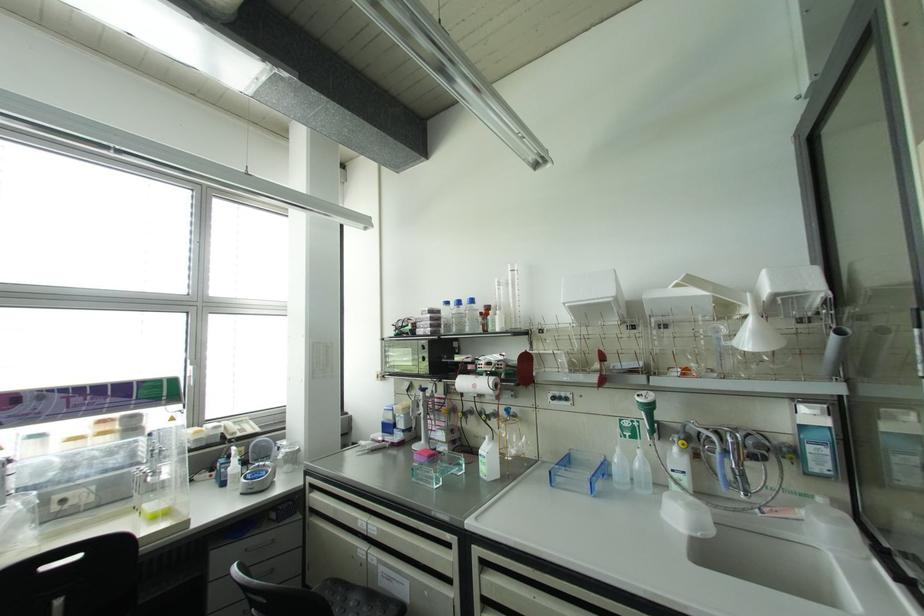
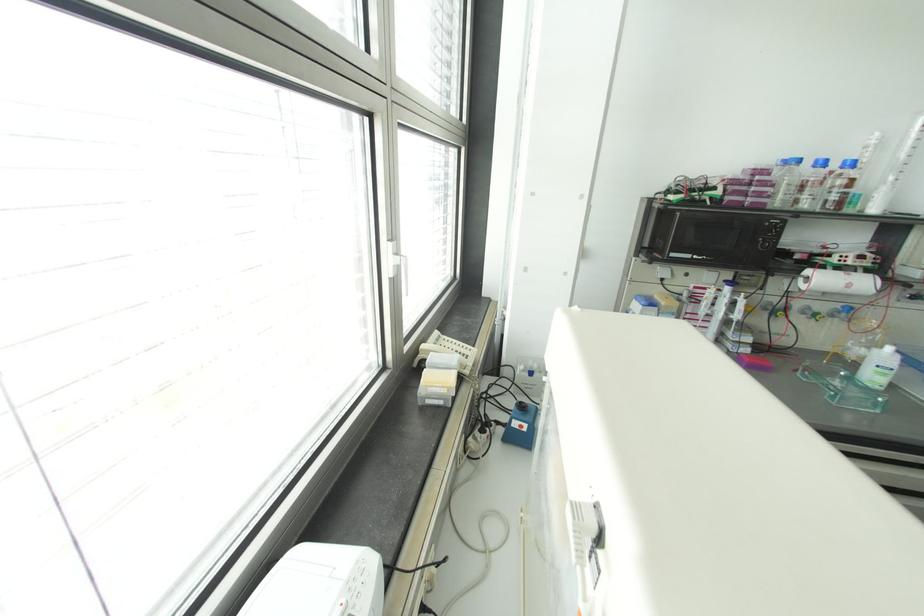
The point at (421,415) is marked in the first image. Where is the corresponding point in the second image?

(736, 315)